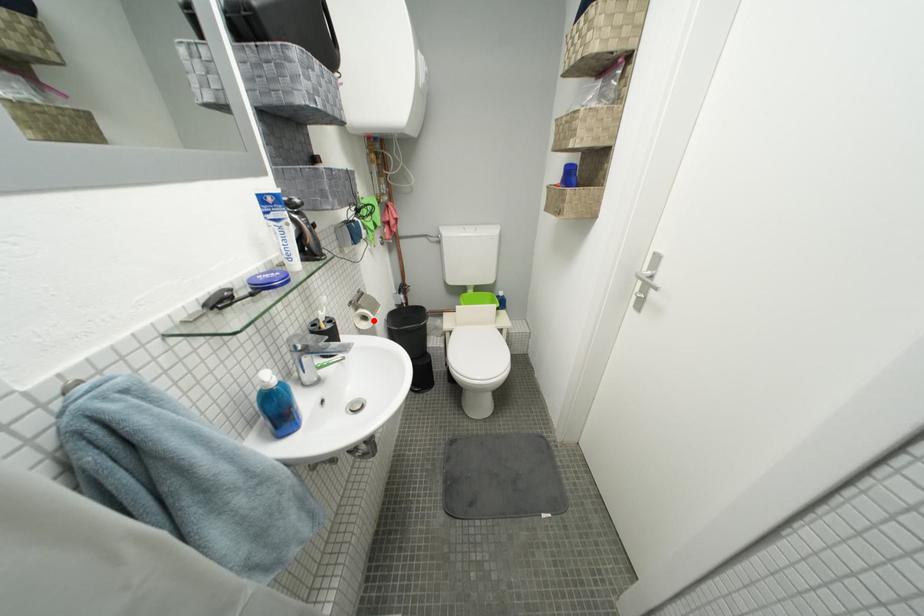
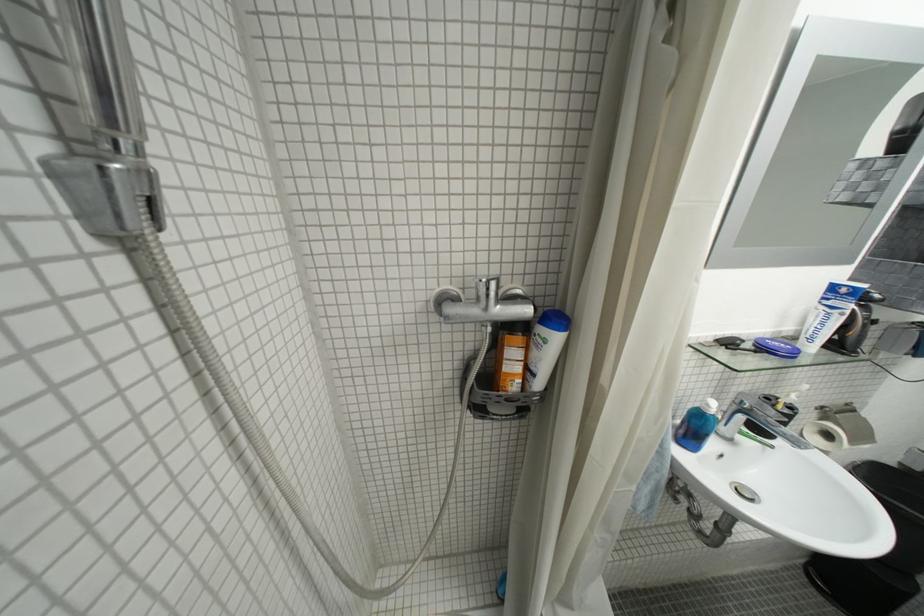
Question: I am providing you with two images of the same scene from different viewpoints. Given a red point in image1, look at the same physical point in image2. Is it:

Choices:
 (A) Closer to the viewpoint
 (B) Farther from the viewpoint

Answer: (B)